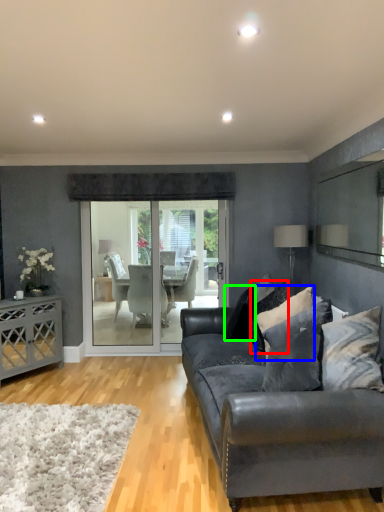
Question: Estimate the real-world distances between objects in this image. Which object is farther from pillow (highlighted by a red box), pillow (highlighted by a blue box) or pillow (highlighted by a green box)?

Choices:
 (A) pillow
 (B) pillow

Answer: (A)